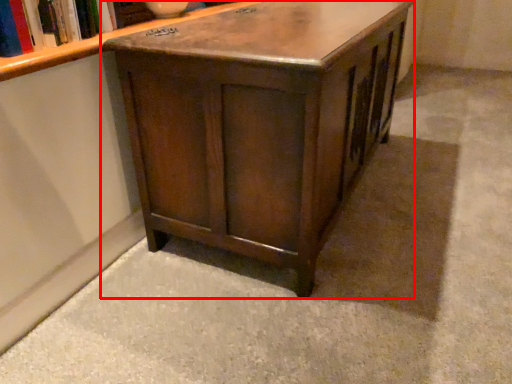
Question: In this image, where is table (annotated by the red box) located relative to book?

Choices:
 (A) right
 (B) left

Answer: (A)